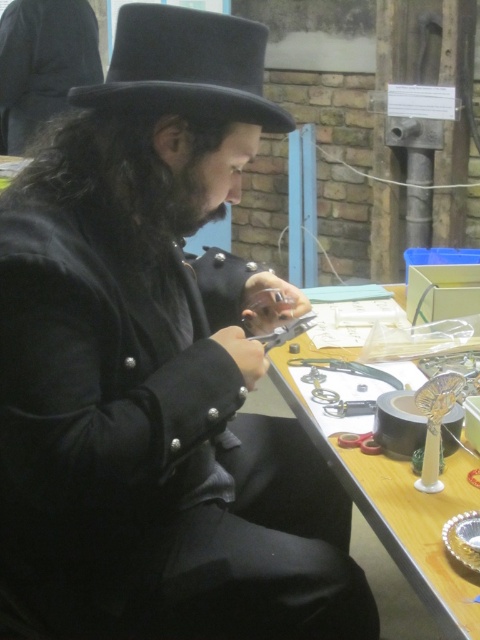
You are organizing a display and need to place the black felt dress hat at upper center and the wooden table at center. Which object should you place first if you want to follow the rule of placing smaller items before larger ones?

The black felt dress hat at upper center is smaller than the wooden table at center, so you should place the black felt dress hat at upper center first.

You are organizing a display in a museum and need to place two hats from the image onto a shelf. The shelf has a maximum length of 8 feet. Can both the black felt dress hat at upper center and the black matte hat at upper left fit side by side on the shelf without overlapping?

The black felt dress hat at upper center and the black matte hat at upper left are 8.20 feet apart from each other. Since the shelf is only 8 feet long, placing them side by side would exceed the shelf length by 0.20 feet. Therefore, they cannot fit without overlapping.

You are a guest at a party and see the wooden table at center and the black matte hat at upper left. Which object is closer to the ceiling?

The black matte hat at upper left is closer to the ceiling because it is positioned above the wooden table at center.